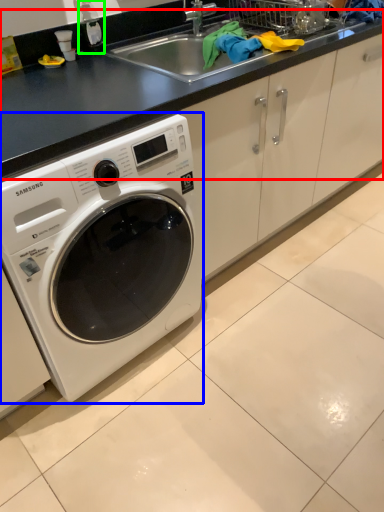
Question: Which object is positioned farthest from counter top (highlighted by a red box)? Select from washing machine (highlighted by a blue box) and bottle (highlighted by a green box).

Choices:
 (A) washing machine
 (B) bottle

Answer: (B)